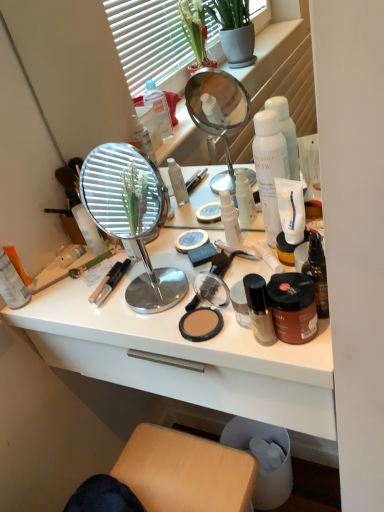
This screenshot has width=384, height=512. What are the coordinates of `free area in between matte black brush at lower left and white matte pump bottle at center, which appears as the 4th toiletry when viewed from the right` in the screenshot? It's located at (129, 264).